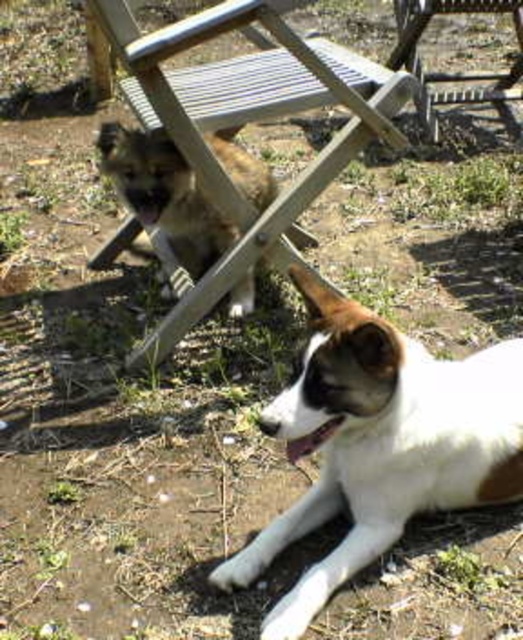
Question: Which object is closer to the camera taking this photo?

Choices:
 (A) metallic silver beach chair at upper right
 (B) wooden at upper center
 (C) brown fur dog at center
 (D) white fur dog at lower right

Answer: (D)

Question: Which point is closer to the camera?

Choices:
 (A) (418, 109)
 (B) (244, 90)
 (C) (202, 214)
 (D) (267, 547)

Answer: (D)

Question: Does brown fur dog at center appear on the right side of metallic silver beach chair at upper right?

Choices:
 (A) yes
 (B) no

Answer: (B)

Question: Considering the real-world distances, which object is closest to the brown fur dog at center?

Choices:
 (A) metallic silver beach chair at upper right
 (B) white fur dog at lower right

Answer: (B)

Question: Does wooden at upper center have a lesser width compared to metallic silver beach chair at upper right?

Choices:
 (A) no
 (B) yes

Answer: (A)

Question: Is white fur dog at lower right closer to camera compared to wooden at upper center?

Choices:
 (A) no
 (B) yes

Answer: (B)